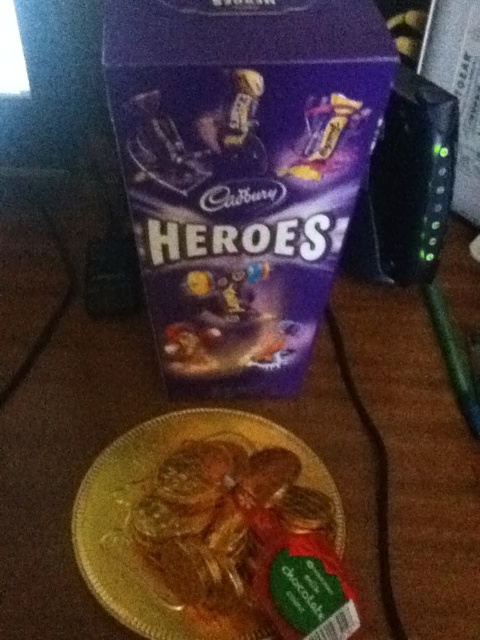
Can you confirm if purple glossy chocolate box at upper center is bigger than golden textured cookies at center?

Yes.

Is purple glossy chocolate box at upper center in front of golden textured cookies at center?

Yes, purple glossy chocolate box at upper center is in front of golden textured cookies at center.

Locate an element on the screen. purple glossy chocolate box at upper center is located at coordinates (241, 172).

What are the coordinates of `purple glossy chocolate box at upper center` in the screenshot? It's located at (241, 172).

Can you confirm if gold foil plate at center is positioned above golden textured cookies at center?

Yes.

Is gold foil plate at center smaller than golden textured cookies at center?

Incorrect, gold foil plate at center is not smaller in size than golden textured cookies at center.

Which is in front, point (409, 298) or point (291, 545)?

Point (291, 545) is in front.

At what (x,y) coordinates should I click in order to perform the action: click on gold foil plate at center. Please return your answer as a coordinate pair (x, y). The height and width of the screenshot is (640, 480). Looking at the image, I should click on (111, 440).

Which is behind, point (441, 566) or point (287, 173)?

Point (441, 566)

Which of these two, gold foil plate at center or purple glossy chocolate box at upper center, stands taller?

gold foil plate at center

Does point (0, 307) come closer to viewer compared to point (164, 54)?

No, it is behind (164, 54).

You are a GUI agent. You are given a task and a screenshot of the screen. Output one action in this format:
    pyautogui.click(x=<x>, y=<y>)
    Task: Click on the gold foil plate at center
    This screenshot has height=640, width=480.
    Given the screenshot: What is the action you would take?
    pyautogui.click(x=111, y=440)